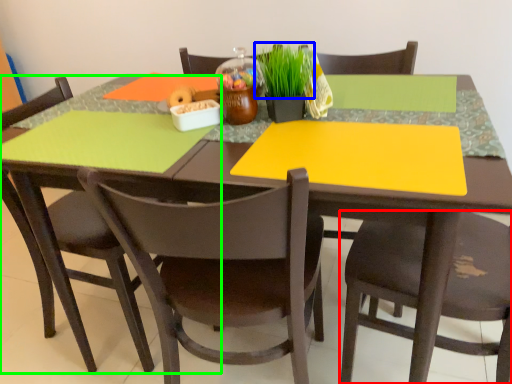
Question: Which object is positioned farthest from chair (highlighted by a red box)? Select from plant (highlighted by a blue box) and chair (highlighted by a green box).

Choices:
 (A) plant
 (B) chair

Answer: (B)